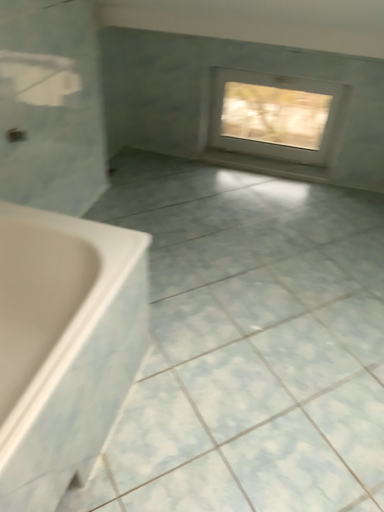
Question: Can you see white plastic bathtub at lower left touching white frosted glass window at upper center?

Choices:
 (A) yes
 (B) no

Answer: (B)

Question: Can you confirm if white plastic bathtub at lower left is shorter than white frosted glass window at upper center?

Choices:
 (A) yes
 (B) no

Answer: (A)

Question: Is white frosted glass window at upper center at the back of white plastic bathtub at lower left?

Choices:
 (A) yes
 (B) no

Answer: (B)

Question: Is white plastic bathtub at lower left thinner than white frosted glass window at upper center?

Choices:
 (A) yes
 (B) no

Answer: (B)

Question: Could white frosted glass window at upper center be considered to be inside white plastic bathtub at lower left?

Choices:
 (A) yes
 (B) no

Answer: (B)

Question: Does white plastic bathtub at lower left have a larger size compared to white frosted glass window at upper center?

Choices:
 (A) no
 (B) yes

Answer: (B)

Question: From a real-world perspective, is white frosted glass window at upper center on top of white glossy ceramic tile at center?

Choices:
 (A) no
 (B) yes

Answer: (B)

Question: Could you tell me if white frosted glass window at upper center is turned towards white glossy ceramic tile at center?

Choices:
 (A) no
 (B) yes

Answer: (B)

Question: Is the depth of white frosted glass window at upper center greater than that of white glossy ceramic tile at center?

Choices:
 (A) no
 (B) yes

Answer: (B)

Question: Considering the relative positions of white frosted glass window at upper center and white glossy ceramic tile at center in the image provided, is white frosted glass window at upper center to the left of white glossy ceramic tile at center from the viewer's perspective?

Choices:
 (A) yes
 (B) no

Answer: (B)

Question: Does white frosted glass window at upper center have a lesser height compared to white glossy ceramic tile at center?

Choices:
 (A) no
 (B) yes

Answer: (A)

Question: Considering the relative positions of white frosted glass window at upper center and white glossy ceramic tile at center in the image provided, is white frosted glass window at upper center to the right of white glossy ceramic tile at center from the viewer's perspective?

Choices:
 (A) no
 (B) yes

Answer: (B)

Question: From a real-world perspective, is white frosted glass window at upper center beneath white plastic bathtub at lower left?

Choices:
 (A) yes
 (B) no

Answer: (B)